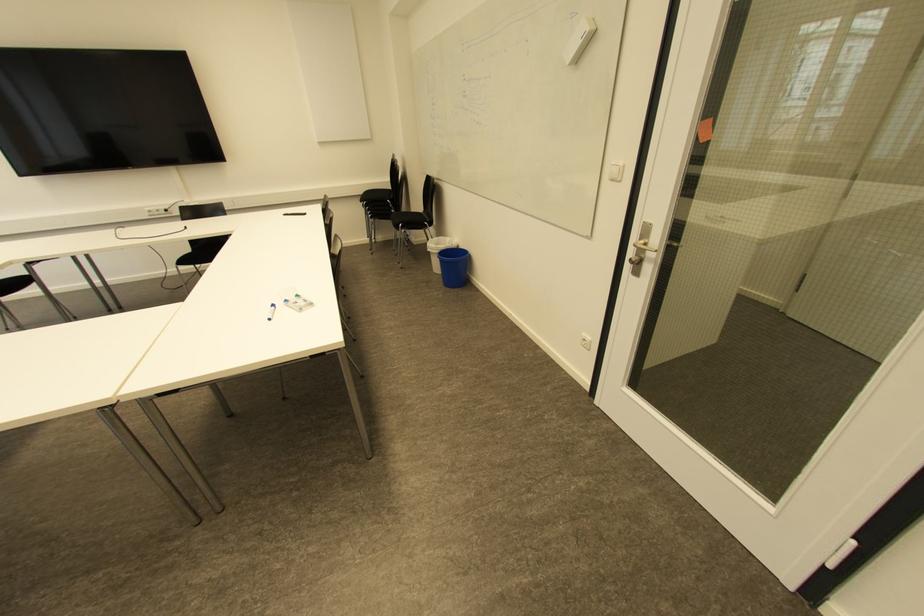
Where would you plugging into the wall electrical socket? Please return your answer as a coordinate pair (x, y).

(585, 341)